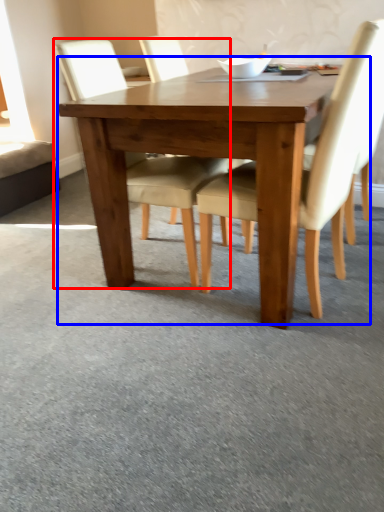
Question: Among these objects, which one is nearest to the camera, chair (highlighted by a red box) or kitchen & dining room table (highlighted by a blue box)?

Choices:
 (A) chair
 (B) kitchen & dining room table

Answer: (B)